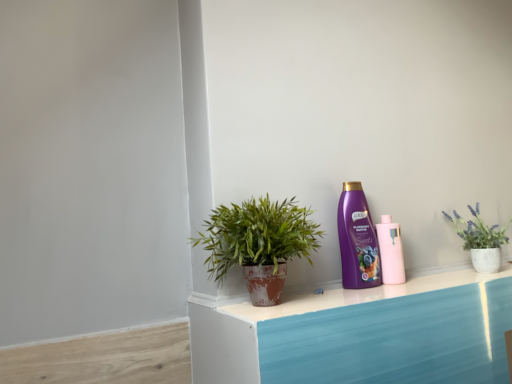
Question: Considering their positions, is terracotta pot plant at center located in front of or behind pink matte bottle at center-right, which appears as the second bottle when viewed from the left?

Choices:
 (A) front
 (B) behind

Answer: (A)

Question: Is terracotta pot plant at center taller or shorter than pink matte bottle at center-right, which appears as the 1th bottle when viewed from the right?

Choices:
 (A) tall
 (B) short

Answer: (A)

Question: Estimate the real-world distances between objects in this image. Which object is closer to the purple plastic bottle at center-right, arranged as the 1th bottle when viewed from the left?

Choices:
 (A) terracotta pot plant at center
 (B) pink matte bottle at center-right, which appears as the second bottle when viewed from the left

Answer: (B)

Question: Which object is positioned farthest from the purple plastic bottle at center-right, arranged as the 1th bottle when viewed from the left?

Choices:
 (A) pink matte bottle at center-right, which appears as the second bottle when viewed from the left
 (B) terracotta pot plant at center

Answer: (B)